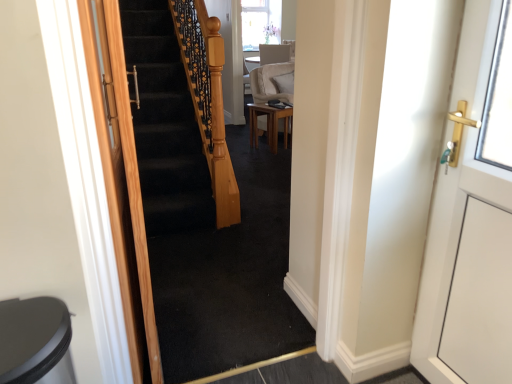
The width and height of the screenshot is (512, 384). What are the coordinates of `vacant space in black carpeted stairs at center (from a real-world perspective)` in the screenshot? It's located at (262, 369).